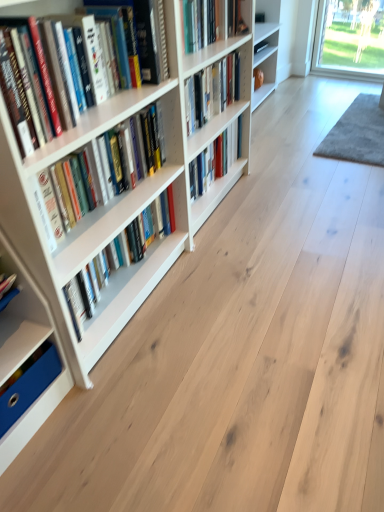
Question: Considering the relative positions of hardcover books at left, which is counted as the second book, starting from the bottom, and blue cardboard box at lower left, the fifth book when ordered from top to bottom, in the image provided, is hardcover books at left, which is counted as the second book, starting from the bottom, to the right of blue cardboard box at lower left, the fifth book when ordered from top to bottom, from the viewer's perspective?

Choices:
 (A) no
 (B) yes

Answer: (B)

Question: Is hardcover books at left, which is the 4th book in top-to-bottom order, facing away from blue cardboard box at lower left, the 1th book when ordered from bottom to top?

Choices:
 (A) no
 (B) yes

Answer: (A)

Question: Considering the relative sizes of hardcover books at left, which is counted as the second book, starting from the bottom, and blue cardboard box at lower left, the 1th book when ordered from bottom to top, in the image provided, is hardcover books at left, which is counted as the second book, starting from the bottom, shorter than blue cardboard box at lower left, the 1th book when ordered from bottom to top,?

Choices:
 (A) yes
 (B) no

Answer: (B)

Question: Would you say hardcover books at left, which is counted as the second book, starting from the bottom, is outside blue cardboard box at lower left, the fifth book when ordered from top to bottom?

Choices:
 (A) no
 (B) yes

Answer: (B)

Question: Is hardcover books at left, which is the 4th book in top-to-bottom order, positioned in front of blue cardboard box at lower left, the 1th book when ordered from bottom to top?

Choices:
 (A) yes
 (B) no

Answer: (B)

Question: From the image's perspective, is hardcover books at left, which is counted as the second book, starting from the bottom, beneath blue cardboard box at lower left, the fifth book when ordered from top to bottom?

Choices:
 (A) no
 (B) yes

Answer: (A)

Question: From a real-world perspective, is hardcover book at center, acting as the fifth book starting from the bottom, positioned over hardcover book at center, which is the 3th book from bottom to top, based on gravity?

Choices:
 (A) no
 (B) yes

Answer: (B)

Question: Is hardcover book at center, acting as the 1th book starting from the top, not within hardcover book at center, which ranks as the third book in top-to-bottom order?

Choices:
 (A) no
 (B) yes

Answer: (B)

Question: Does hardcover book at center, acting as the fifth book starting from the bottom, have a smaller size compared to hardcover book at center, which is the 3th book from bottom to top?

Choices:
 (A) yes
 (B) no

Answer: (B)

Question: Is hardcover book at center, which is the 3th book from bottom to top, completely or partially inside hardcover book at center, acting as the fifth book starting from the bottom?

Choices:
 (A) yes
 (B) no

Answer: (B)

Question: Is hardcover book at center, acting as the fifth book starting from the bottom, wider than hardcover book at center, which is the 3th book from bottom to top?

Choices:
 (A) yes
 (B) no

Answer: (A)

Question: Is hardcover book at center, acting as the 1th book starting from the top, far from hardcover book at center, which is the 3th book from bottom to top?

Choices:
 (A) yes
 (B) no

Answer: (B)

Question: Is white matte bookcase at left wider than hardcover books at left, which ranks as the fourth book in bottom-to-top order?

Choices:
 (A) yes
 (B) no

Answer: (A)